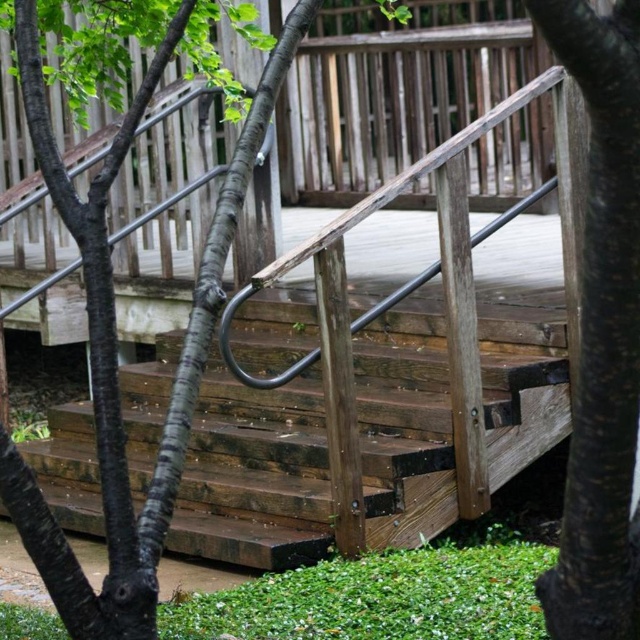
Question: Can you confirm if weathered wood stairs at center is positioned above dark brown wood at center?

Choices:
 (A) yes
 (B) no

Answer: (B)

Question: Does weathered wood stairs at center appear over dark brown wood at center?

Choices:
 (A) yes
 (B) no

Answer: (B)

Question: Which object is farther from the camera taking this photo?

Choices:
 (A) dark brown wood at center
 (B) weathered wood stairs at center

Answer: (B)

Question: Can you confirm if weathered wood stairs at center is smaller than dark brown wood at center?

Choices:
 (A) yes
 (B) no

Answer: (B)

Question: Which point appears closest to the camera in this image?

Choices:
 (A) (600, 129)
 (B) (216, 364)

Answer: (A)